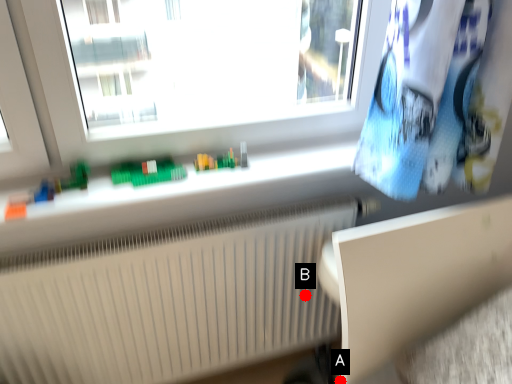
Question: Two points are circled on the image, labeled by A and B beside each circle. Among these points, which one is nearest to the camera?

Choices:
 (A) A is closer
 (B) B is closer

Answer: (A)